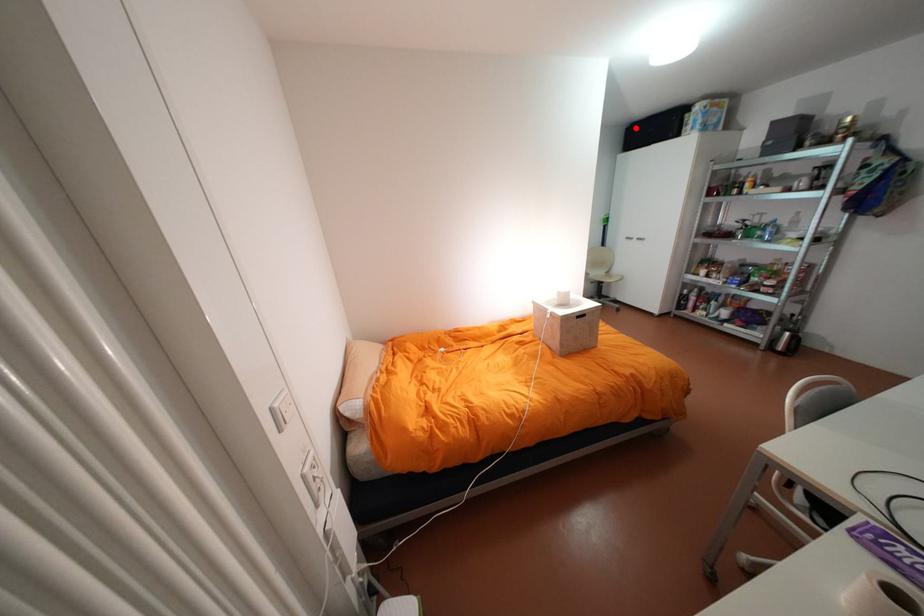
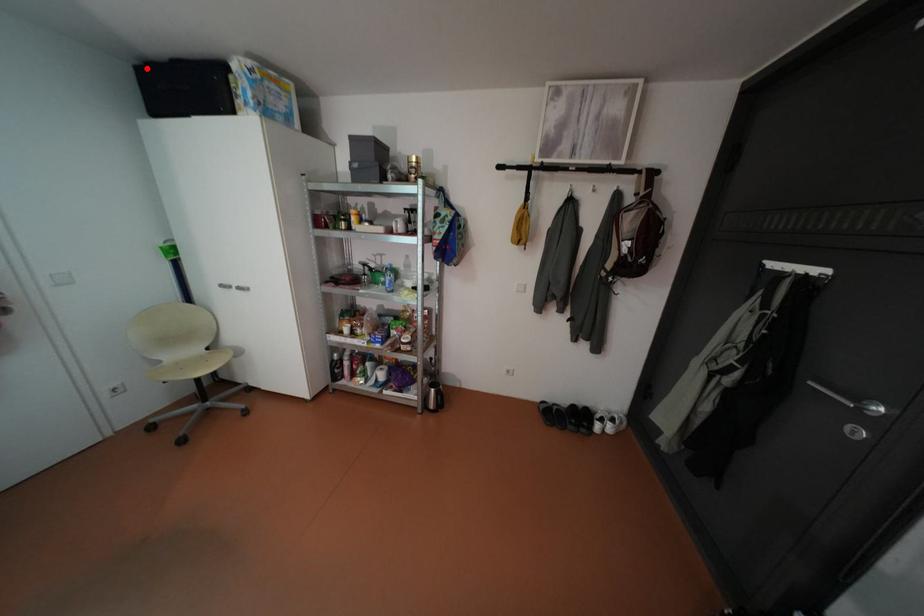
I am providing you with two images of the same scene from different viewpoints. A red point is marked on the first image and another point is marked on the second image. Is the marked point in image1 the same physical position as the marked point in image2?

Yes